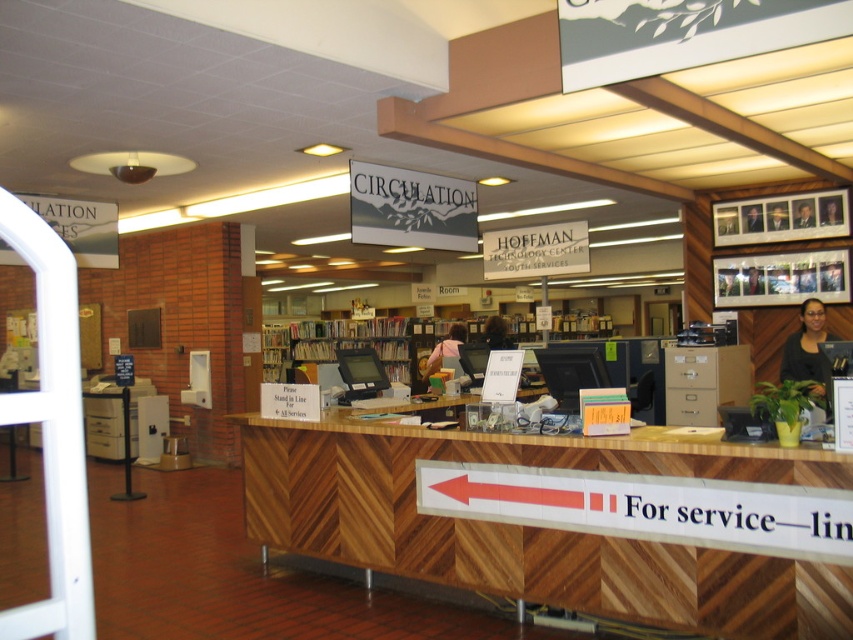
Question: Does wooden chevron-patterned desk at center appear on the right side of matte pink shirt at center?

Choices:
 (A) yes
 (B) no

Answer: (A)

Question: Is matte pink shirt at center above matte black hair at center?

Choices:
 (A) no
 (B) yes

Answer: (A)

Question: Is black matte shirt at right closer to camera compared to matte pink shirt at center?

Choices:
 (A) no
 (B) yes

Answer: (B)

Question: Which point appears closest to the camera in this image?

Choices:
 (A) (430, 358)
 (B) (495, 342)

Answer: (B)

Question: Which of the following is the farthest from the observer?

Choices:
 (A) matte black hair at center
 (B) matte pink shirt at center

Answer: (A)

Question: Which of the following is the farthest from the observer?

Choices:
 (A) matte black hair at center
 (B) black matte shirt at right
 (C) wooden chevron-patterned desk at center
 (D) matte pink shirt at center

Answer: (A)